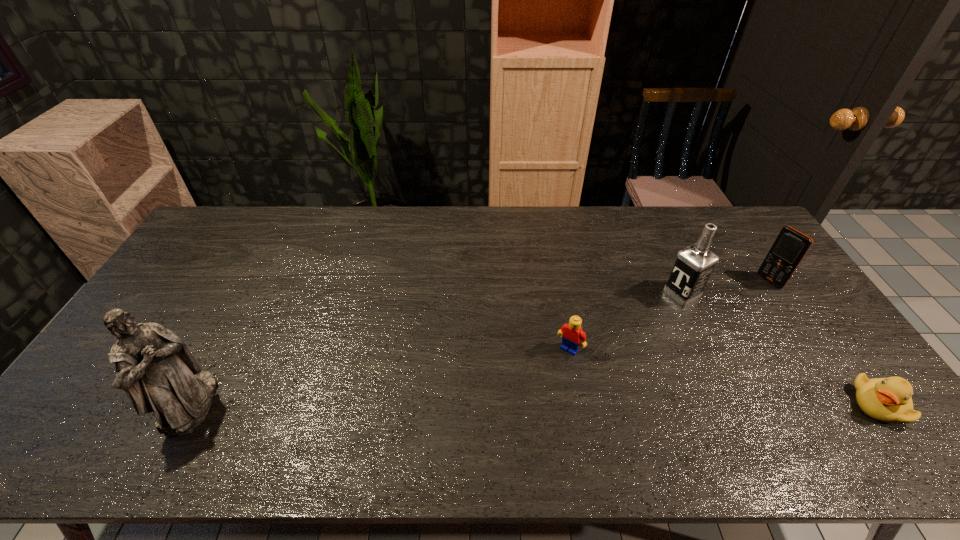
Locate an element on the screen. The height and width of the screenshot is (540, 960). vacant space in between the second tallest object and the second shortest object is located at coordinates (626, 321).

Find the location of a particular element. The height and width of the screenshot is (540, 960). unoccupied position between the shortest object and the cellular telephone is located at coordinates (825, 342).

Identify the location of free spot between the third shortest object and the figurine. (480, 342).

At what (x,y) coordinates should I click in order to perform the action: click on free point between the shortest object and the vodka. Please return your answer as a coordinate pair (x, y). Image resolution: width=960 pixels, height=540 pixels. Looking at the image, I should click on (780, 349).

Find the location of a particular element. vacant space in between the leftmost object and the second object from left to right is located at coordinates (379, 376).

At what (x,y) coordinates should I click in order to perform the action: click on vacant space that is in between the Lego and the tallest object. Please return your answer as a coordinate pair (x, y). This screenshot has height=540, width=960. Looking at the image, I should click on (379, 376).

Where is `free space between the Lego and the cellular telephone`? free space between the Lego and the cellular telephone is located at coordinates (670, 315).

The height and width of the screenshot is (540, 960). Find the location of `object that stands as the fourth closest to the fourth shortest object`. object that stands as the fourth closest to the fourth shortest object is located at coordinates (154, 367).

Where is `the fourth closest object relative to the shortest object`? This screenshot has height=540, width=960. the fourth closest object relative to the shortest object is located at coordinates (154, 367).

Where is `vacant space that satisfies the following two spatial constraints: 1. on the front side of the shortest object; 2. on the front-facing side of the third shortest object`? The height and width of the screenshot is (540, 960). vacant space that satisfies the following two spatial constraints: 1. on the front side of the shortest object; 2. on the front-facing side of the third shortest object is located at coordinates (852, 404).